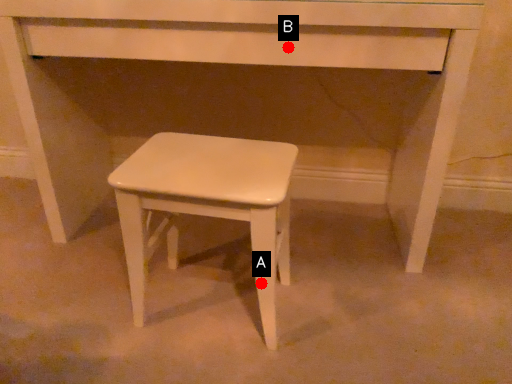
Question: Two points are circled on the image, labeled by A and B beside each circle. Which point appears farthest from the camera in this image?

Choices:
 (A) A is further
 (B) B is further

Answer: (B)